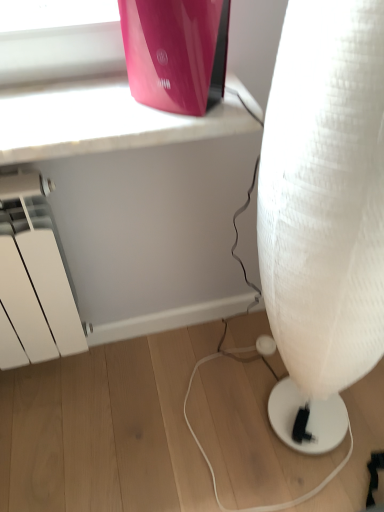
I want to click on white fabric lamp at lower right, so click(x=323, y=210).

What do you see at coordinates (323, 210) in the screenshot? I see `white fabric lamp at lower right` at bounding box center [323, 210].

Measure the distance between glossy plastic router at upper center and camera.

glossy plastic router at upper center is 24.29 inches away from camera.

What do you see at coordinates (176, 52) in the screenshot?
I see `glossy plastic router at upper center` at bounding box center [176, 52].

At what (x,y) coordinates should I click in order to perform the action: click on glossy plastic router at upper center. Please return your answer as a coordinate pair (x, y). Looking at the image, I should click on (176, 52).

Where is `white fabric lamp at lower right`? white fabric lamp at lower right is located at coordinates (323, 210).

Considering the relative positions of white fabric lamp at lower right and glossy plastic router at upper center in the image provided, is white fabric lamp at lower right to the left or to the right of glossy plastic router at upper center?

In the image, white fabric lamp at lower right appears on the right side of glossy plastic router at upper center.

Which object is further away from the camera, white fabric lamp at lower right or glossy plastic router at upper center?

glossy plastic router at upper center.

Considering the points (330, 361) and (211, 87), which point is in front, point (330, 361) or point (211, 87)?

The point (211, 87) is more forward.

From the image's perspective, is white fabric lamp at lower right located above glossy plastic router at upper center?

No, from the image's perspective, white fabric lamp at lower right is not above glossy plastic router at upper center.

From a real-world perspective, is white fabric lamp at lower right physically located above or below glossy plastic router at upper center?

white fabric lamp at lower right is below glossy plastic router at upper center.

Is white fabric lamp at lower right thinner than glossy plastic router at upper center?

Incorrect, the width of white fabric lamp at lower right is not less than that of glossy plastic router at upper center.

Is white fabric lamp at lower right shorter than glossy plastic router at upper center?

Incorrect, the height of white fabric lamp at lower right does not fall short of that of glossy plastic router at upper center.

Considering the sizes of objects white fabric lamp at lower right and glossy plastic router at upper center in the image provided, who is bigger, white fabric lamp at lower right or glossy plastic router at upper center?

With larger size is white fabric lamp at lower right.

Can we say white fabric lamp at lower right lies outside glossy plastic router at upper center?

Yes, white fabric lamp at lower right is not within glossy plastic router at upper center.

Are white fabric lamp at lower right and glossy plastic router at upper center making contact?

No, white fabric lamp at lower right is not making contact with glossy plastic router at upper center.

Is white fabric lamp at lower right positioned with its back to glossy plastic router at upper center?

No, white fabric lamp at lower right is not facing away from glossy plastic router at upper center.

How many degrees apart are the facing directions of white fabric lamp at lower right and glossy plastic router at upper center?

There is a 88.1-degree angle between the facing directions of white fabric lamp at lower right and glossy plastic router at upper center.

Locate an element on the screen. lamp to the right of glossy plastic router at upper center is located at coordinates (323, 210).

Which object is positioned more to the right, glossy plastic router at upper center or white fabric lamp at lower right?

white fabric lamp at lower right is more to the right.

Which object is further away from the camera, glossy plastic router at upper center or white fabric lamp at lower right?

glossy plastic router at upper center.

Is point (204, 2) farther from camera compared to point (378, 297)?

No.

From the image's perspective, which one is positioned lower, glossy plastic router at upper center or white fabric lamp at lower right?

white fabric lamp at lower right, from the image's perspective.

From a real-world perspective, is glossy plastic router at upper center physically located above or below white fabric lamp at lower right?

glossy plastic router at upper center is above white fabric lamp at lower right.

Considering the sizes of glossy plastic router at upper center and white fabric lamp at lower right in the image, is glossy plastic router at upper center wider or thinner than white fabric lamp at lower right?

glossy plastic router at upper center is thinner than white fabric lamp at lower right.

In terms of height, does glossy plastic router at upper center look taller or shorter compared to white fabric lamp at lower right?

Considering their sizes, glossy plastic router at upper center has less height than white fabric lamp at lower right.

Based on the photo, who is bigger, glossy plastic router at upper center or white fabric lamp at lower right?

Bigger between the two is white fabric lamp at lower right.

Does glossy plastic router at upper center contain white fabric lamp at lower right?

No, white fabric lamp at lower right is not a part of glossy plastic router at upper center.

Is glossy plastic router at upper center beside white fabric lamp at lower right?

No, glossy plastic router at upper center is not beside white fabric lamp at lower right.

Is glossy plastic router at upper center oriented away from white fabric lamp at lower right?

No, glossy plastic router at upper center's orientation is not away from white fabric lamp at lower right.

Locate an element on the screen. Image resolution: width=384 pixels, height=512 pixels. appliance above the white fabric lamp at lower right (from the image's perspective) is located at coordinates (176, 52).

Find the location of a particular element. The image size is (384, 512). lamp on the right of glossy plastic router at upper center is located at coordinates pos(323,210).

At what (x,y) coordinates should I click in order to perform the action: click on appliance on the left side of white fabric lamp at lower right. Please return your answer as a coordinate pair (x, y). The width and height of the screenshot is (384, 512). Looking at the image, I should click on (176, 52).